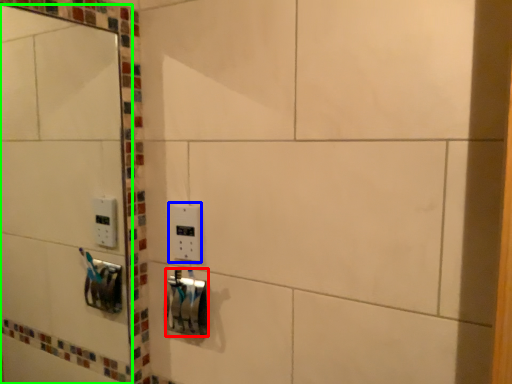
Question: Based on their relative distances, which object is nearer to lock (highlighted by a red box)? Choose from light switch (highlighted by a blue box) and mirror (highlighted by a green box).

Choices:
 (A) light switch
 (B) mirror

Answer: (A)